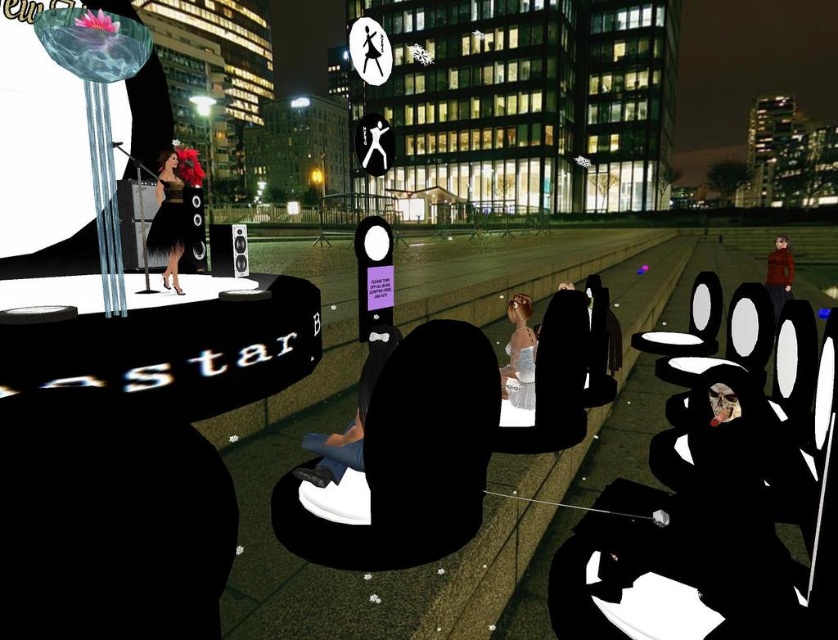
Question: Which is farther from the black satin dress at center?

Choices:
 (A) red wool sweater at right
 (B) silky white dress at center

Answer: (A)

Question: Does black satin dress at center appear over red wool sweater at right?

Choices:
 (A) no
 (B) yes

Answer: (B)

Question: Can you confirm if silky white dress at center is positioned below red wool sweater at right?

Choices:
 (A) no
 (B) yes

Answer: (B)

Question: Among these points, which one is nearest to the camera?

Choices:
 (A) (768, 259)
 (B) (169, 260)

Answer: (B)

Question: Is black satin dress at center below silky white dress at center?

Choices:
 (A) yes
 (B) no

Answer: (B)

Question: Which object appears farthest from the camera in this image?

Choices:
 (A) black satin dress at center
 (B) red wool sweater at right

Answer: (B)